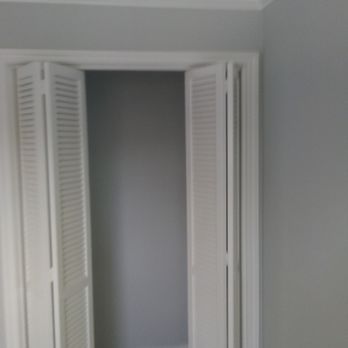
Where is `closet`? closet is located at coordinates (144, 213).